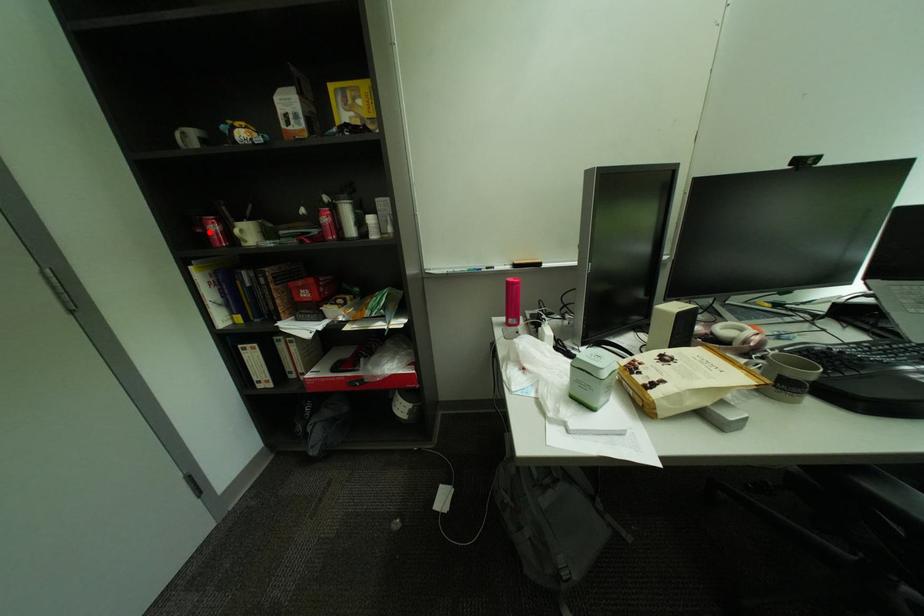
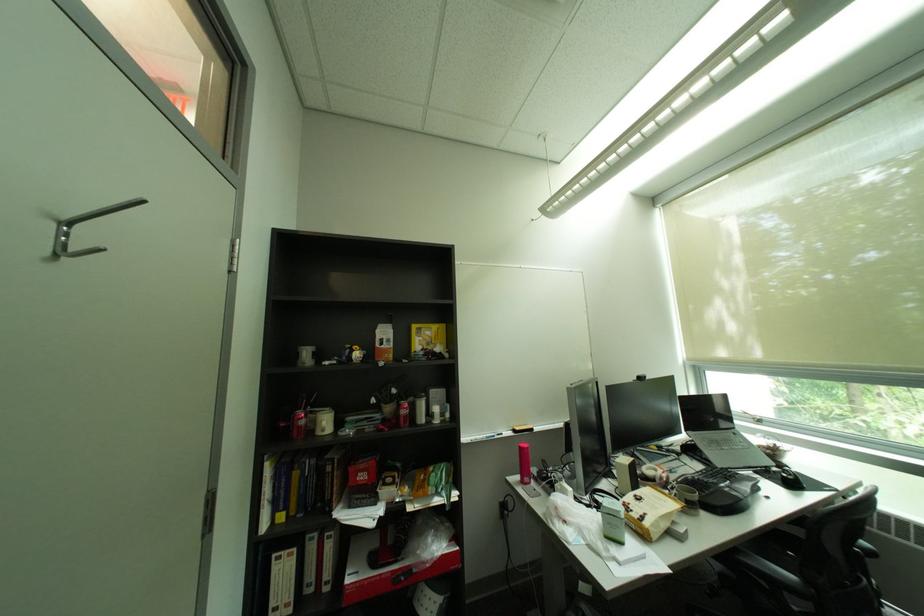
Where in the second image is the point corresponding to the highlighted location from the first image?

(293, 426)